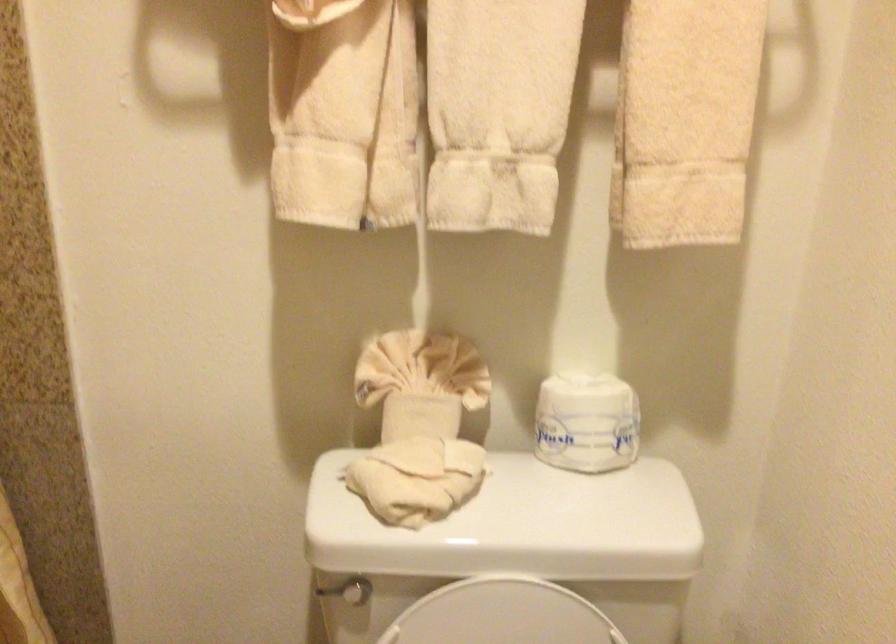
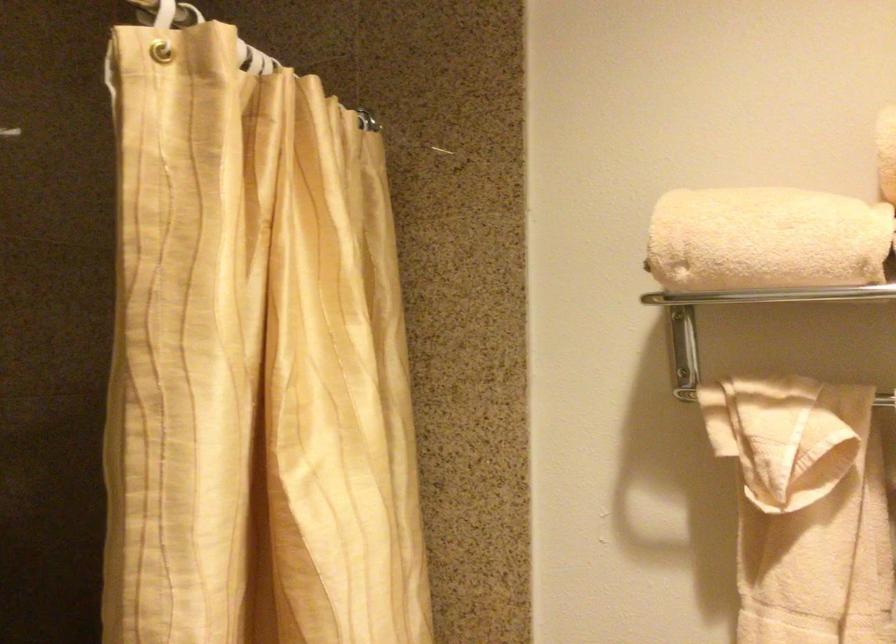
Based on the photo, how did the camera likely rotate?

The rotation direction of the camera is left-up.